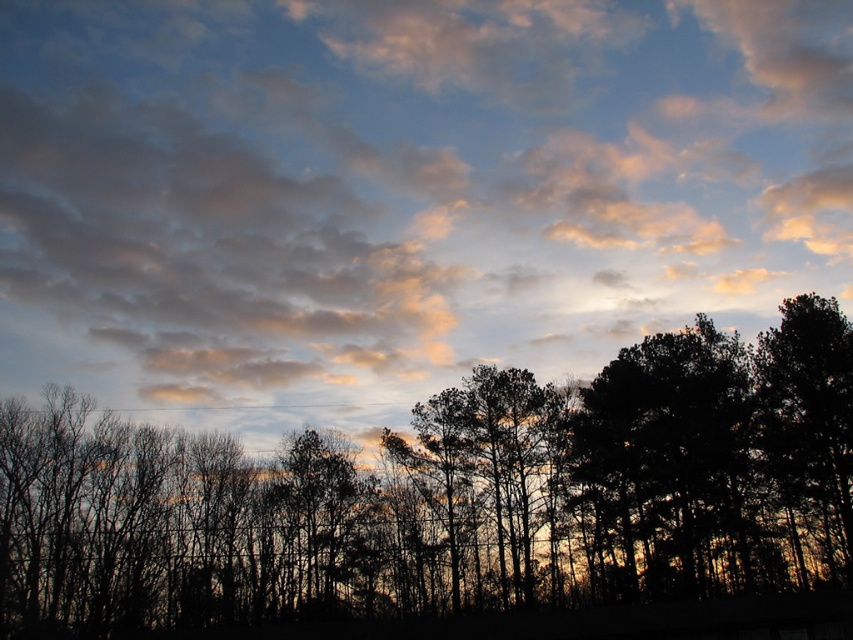
Question: Does cloudy sky at upper center have a smaller size compared to silhouette trees at lower center?

Choices:
 (A) yes
 (B) no

Answer: (B)

Question: Can you confirm if silhouette trees at lower center is thinner than dark green leafy tree at right?

Choices:
 (A) yes
 (B) no

Answer: (B)

Question: Which of the following is the farthest from the observer?

Choices:
 (A) (422, 355)
 (B) (137, 499)

Answer: (A)

Question: Which point is farther from the camera taking this photo?

Choices:
 (A) (776, 428)
 (B) (833, 388)

Answer: (B)

Question: Does cloudy sky at upper center appear under silhouette trees at lower center?

Choices:
 (A) yes
 (B) no

Answer: (B)

Question: Which is nearer to the dark green leafy tree at right?

Choices:
 (A) silhouette trees at lower center
 (B) cloudy sky at upper center

Answer: (A)